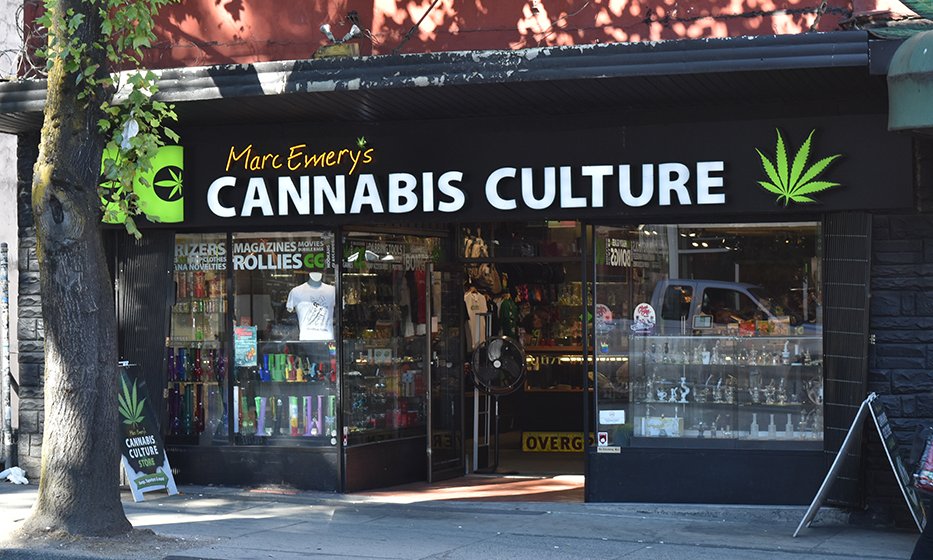
The height and width of the screenshot is (560, 933). Find the location of `doors`. doors is located at coordinates (429, 349), (583, 349).